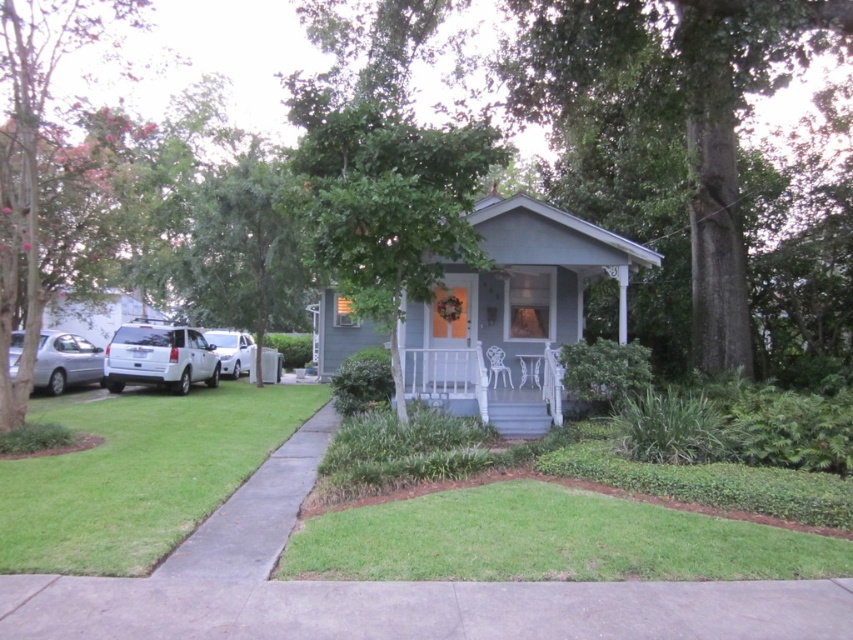
Question: Does white matte suv at left have a greater width compared to satin silver sedan at left?

Choices:
 (A) no
 (B) yes

Answer: (B)

Question: Which point appears closest to the camera in this image?

Choices:
 (A) coord(193,348)
 (B) coord(506,368)
 (C) coord(212,336)

Answer: (B)

Question: Which point is closer to the camera?

Choices:
 (A) satin silver sedan at left
 (B) white painted wood porch at center

Answer: (B)

Question: Does white painted wood porch at center have a larger size compared to white matte suv at left?

Choices:
 (A) yes
 (B) no

Answer: (A)

Question: Can you confirm if white matte suv at left is bigger than white matte car at left?

Choices:
 (A) yes
 (B) no

Answer: (B)

Question: Which of the following is the closest to the observer?

Choices:
 (A) (180, 358)
 (B) (216, 353)
 (C) (509, 372)
 (D) (59, 376)

Answer: (C)